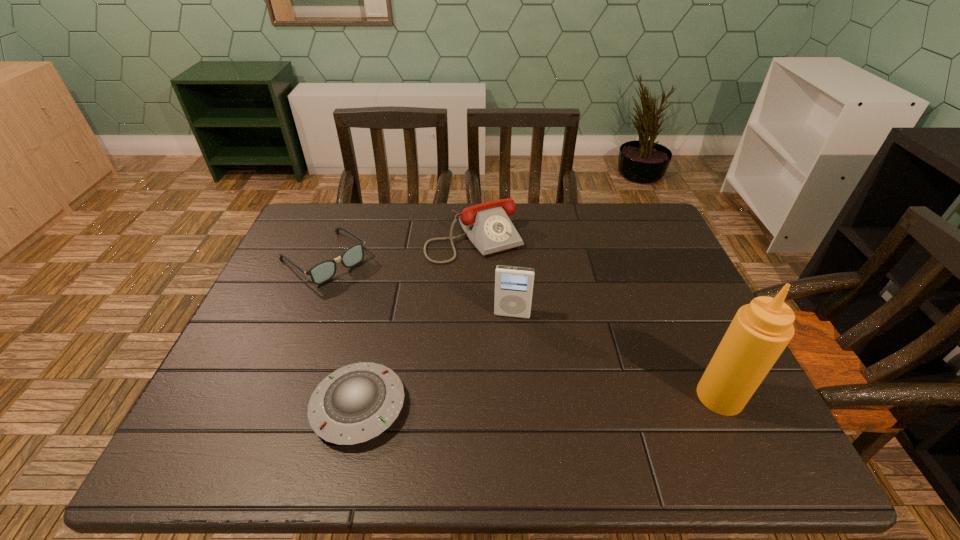
I want to click on vacant spot on the desktop that is between the saucer and the rightmost object and is positioned on the front-facing side of the third farthest object, so click(x=502, y=402).

Find the location of a particular element. Image resolution: width=960 pixels, height=540 pixels. free spot on the desktop that is between the saucer and the tallest object and is positioned on the dial of the telephone is located at coordinates (585, 400).

In order to click on free space on the desktop that is between the shortest object and the condiment and is positioned on the face of the second shortest object in this screenshot , I will do `click(489, 403)`.